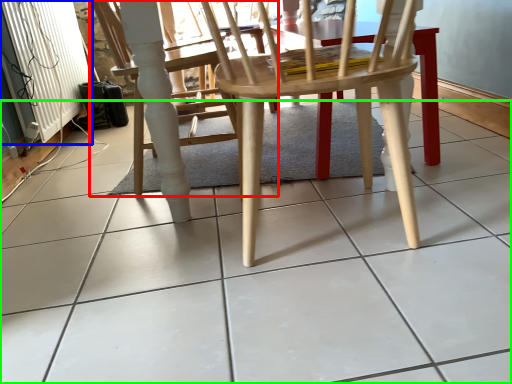
Question: Based on their relative distances, which object is farther from chair (highlighted by a red box)? Choose from radiator (highlighted by a blue box) and ceramic tile (highlighted by a green box).

Choices:
 (A) radiator
 (B) ceramic tile

Answer: (A)